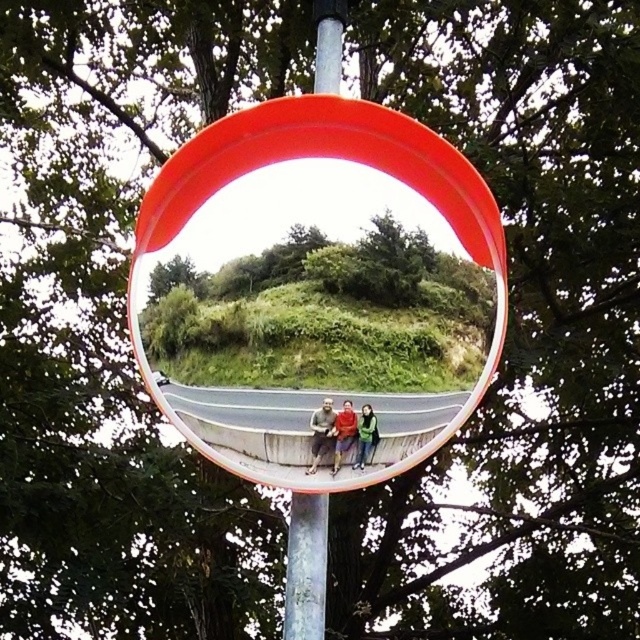
Question: Can you confirm if transparent plastic view mirror at center is positioned above red fabric jacket at center?

Choices:
 (A) yes
 (B) no

Answer: (A)

Question: Which of these objects is positioned farthest from the matte gray shirt at center?

Choices:
 (A) metallic gray pole at center
 (B) red fabric jacket at center
 (C) transparent plastic view mirror at center
 (D) green matte jacket at lower center

Answer: (C)

Question: Is metallic gray pole at center thinner than matte gray shirt at center?

Choices:
 (A) no
 (B) yes

Answer: (A)

Question: Which of the following is the closest to the observer?

Choices:
 (A) (364, 408)
 (B) (314, 445)
 (C) (376, 161)

Answer: (A)

Question: Is metallic gray pole at center above matte gray shirt at center?

Choices:
 (A) yes
 (B) no

Answer: (B)

Question: Which point is closer to the camera?

Choices:
 (A) red fabric jacket at center
 (B) matte gray shirt at center
 (C) metallic gray pole at center

Answer: (A)